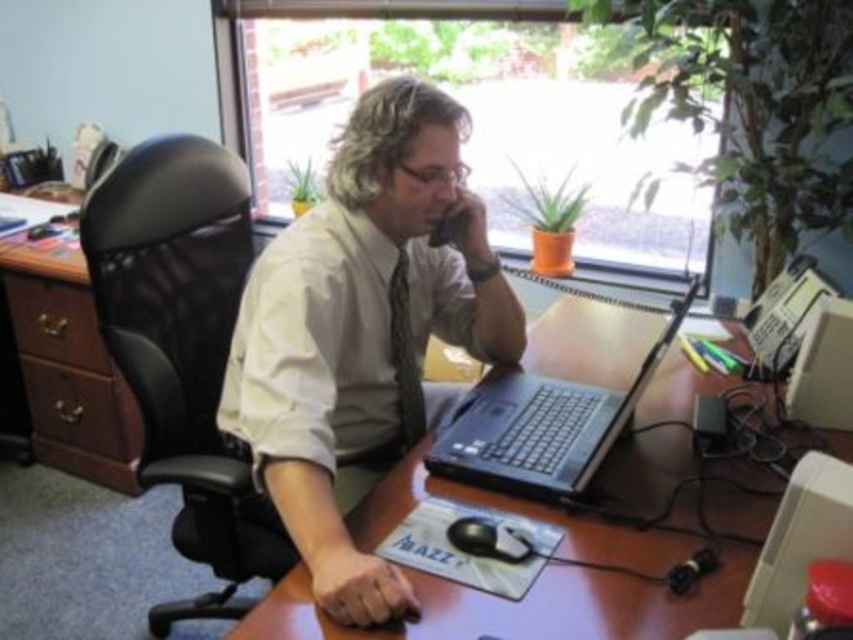
Question: Which object is closer to the camera taking this photo?

Choices:
 (A) black mesh swivel chair at left
 (B) white smooth dress shirt at center
 (C) textured gray tie at center

Answer: (B)

Question: Which object is the farthest from the black mesh swivel chair at left?

Choices:
 (A) white matte shirt at center
 (B) black plastic laptop at center

Answer: (B)

Question: Does brown wooden table at center appear on the right side of textured gray tie at center?

Choices:
 (A) no
 (B) yes

Answer: (B)

Question: Which point appears closest to the camera in this image?

Choices:
 (A) (172, 396)
 (B) (421, 451)
 (C) (596, 400)
 (D) (291, 381)

Answer: (D)

Question: Where is white smooth dress shirt at center located in relation to textured gray tie at center in the image?

Choices:
 (A) above
 (B) below

Answer: (A)

Question: Can you confirm if white smooth dress shirt at center is positioned to the right of black plastic laptop at center?

Choices:
 (A) yes
 (B) no

Answer: (B)